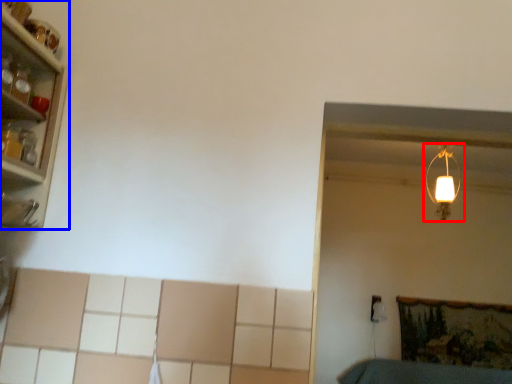
Question: Which object is further to the camera taking this photo, lamp (highlighted by a red box) or shelf (highlighted by a blue box)?

Choices:
 (A) lamp
 (B) shelf

Answer: (A)